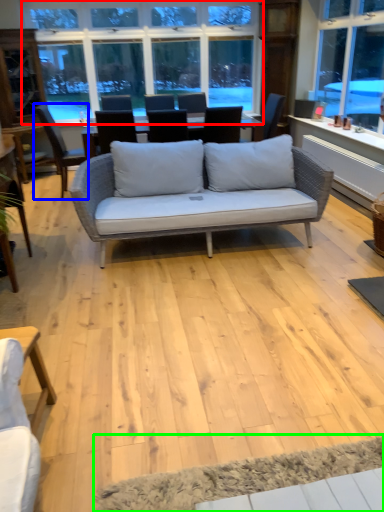
Question: Which object is positioned closest to window (highlighted by a red box)? Select from chair (highlighted by a blue box) and yoga mat (highlighted by a green box).

Choices:
 (A) chair
 (B) yoga mat

Answer: (A)